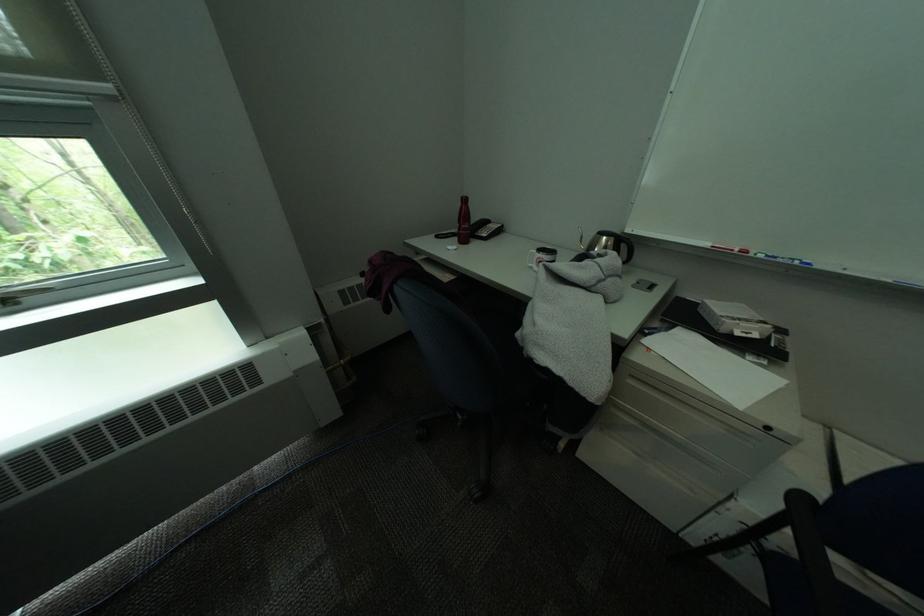
Find where to lift the white mug handle. Please return your answer as a coordinate pair (x, y).

(541, 262)